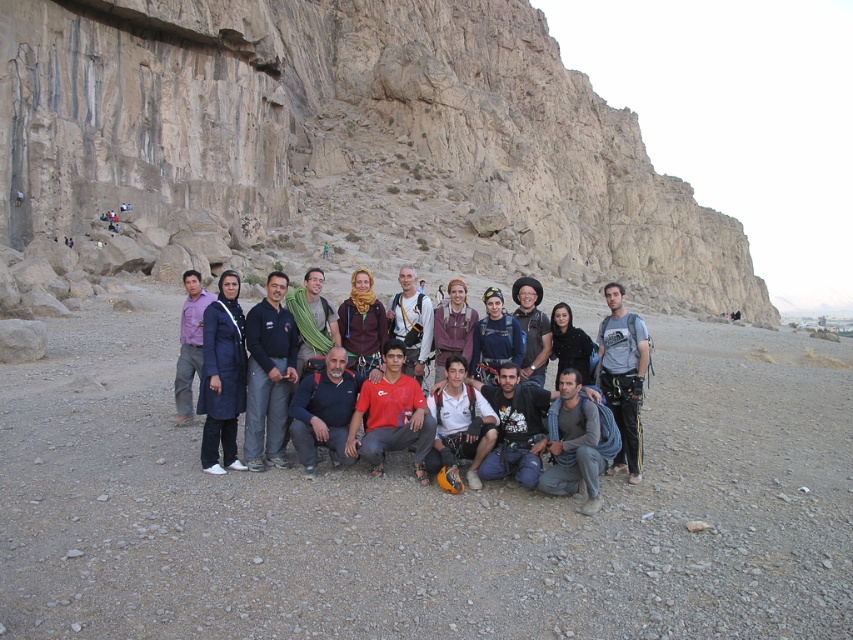
Can you confirm if dark blue fabric shirt at center is wider than red cotton shirt at center?

Yes, dark blue fabric shirt at center is wider than red cotton shirt at center.

Find the location of a particular element. The height and width of the screenshot is (640, 853). dark blue fabric shirt at center is located at coordinates (268, 374).

Where is `dark blue fabric shirt at center`? The image size is (853, 640). dark blue fabric shirt at center is located at coordinates [268, 374].

Is matte gray backpack at center to the right of dark blue jacket at center from the viewer's perspective?

In fact, matte gray backpack at center is to the left of dark blue jacket at center.

At what (x,y) coordinates should I click in order to perform the action: click on matte gray backpack at center. Please return your answer as a coordinate pair (x, y). The image size is (853, 640). Looking at the image, I should click on (410, 323).

Identify the location of matte gray backpack at center. The image size is (853, 640). (410, 323).

Which is more to the right, red cotton shirt at center or dark blue jacket at center?

Positioned to the right is dark blue jacket at center.

Is point (383, 435) in front of point (473, 364)?

Yes, point (383, 435) is in front of point (473, 364).

Who is more distant from viewer, (381, 445) or (469, 369)?

The point (469, 369) is behind.

Find the location of a particular element. red cotton shirt at center is located at coordinates (392, 416).